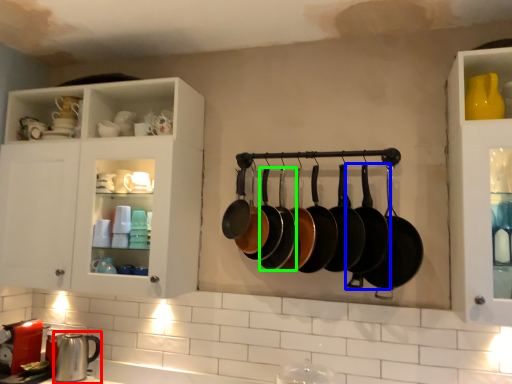
Question: Which object is positioned closest to appliance (highlighted by a red box)? Select from frying pan (highlighted by a blue box) and frying pan (highlighted by a green box).

Choices:
 (A) frying pan
 (B) frying pan

Answer: (B)